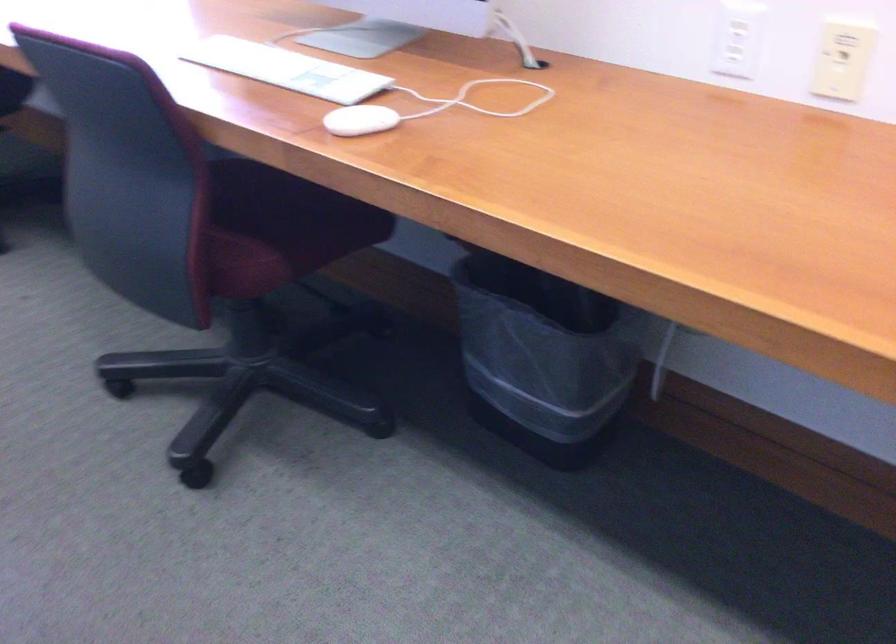
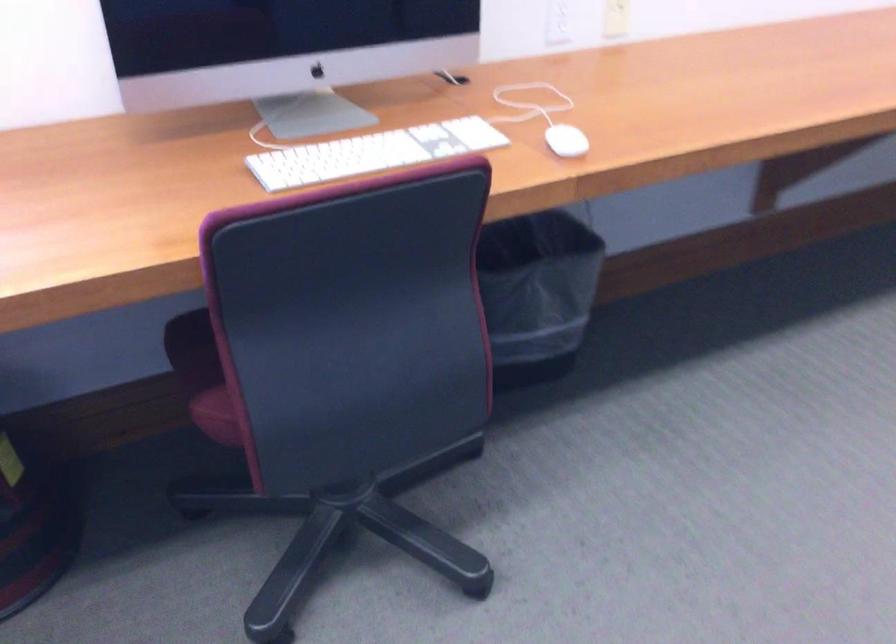
The point at (340, 118) is marked in the first image. Where is the corresponding point in the second image?

(565, 140)